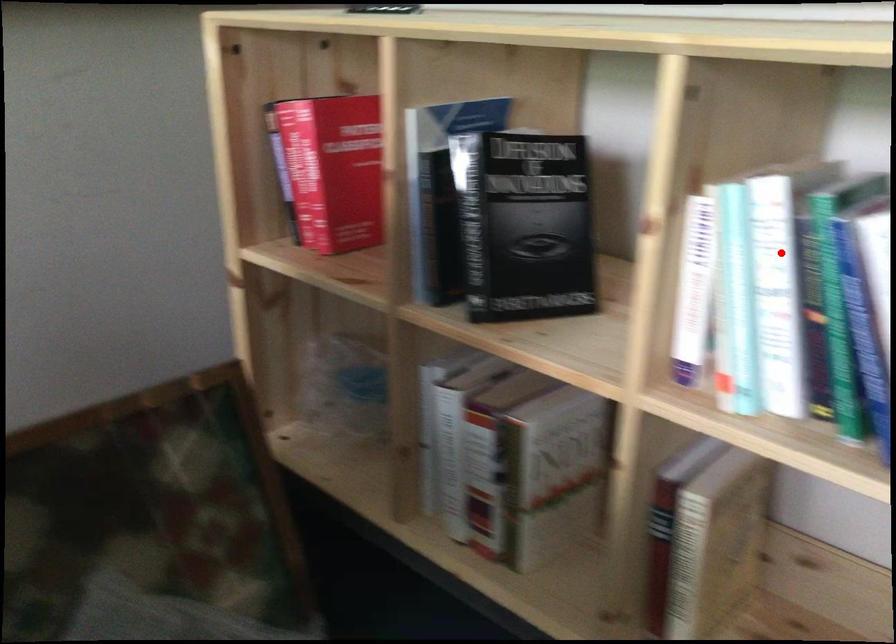
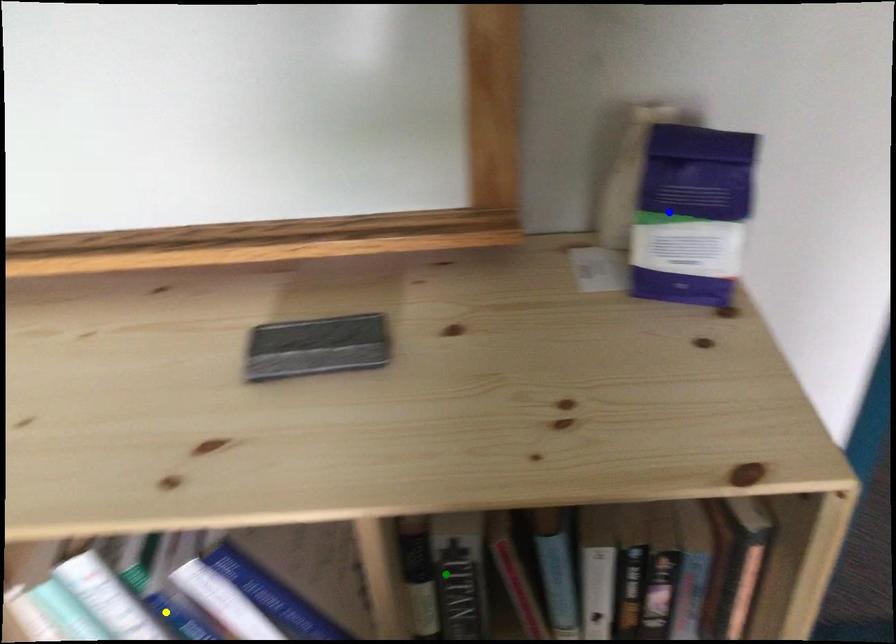
Question: I am providing you with two images of the same scene from different viewpoints. A red point is marked on the first image. You are given multiple points on the second image. Can you choose the point in image 2 that corresponds to the point in image 1?

Choices:
 (A) green point
 (B) yellow point
 (C) blue point

Answer: (B)